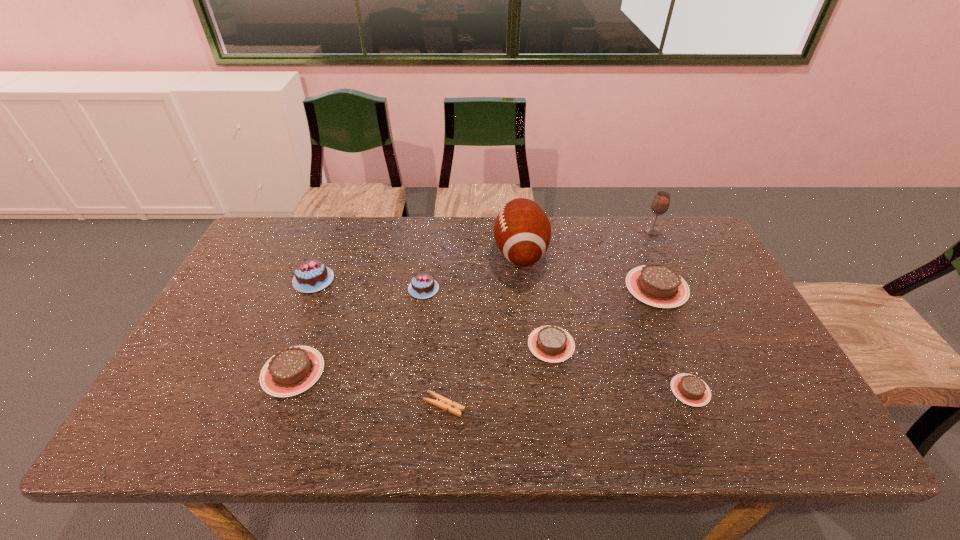
You are a GUI agent. You are given a task and a screenshot of the screen. Output one action in this format:
    pyautogui.click(x=<x>, y=<y>)
    Task: Click on the vacant point located between the clothespin and the third biggest brown chocolate cake
    The height and width of the screenshot is (540, 960).
    Given the screenshot: What is the action you would take?
    pyautogui.click(x=497, y=375)

The height and width of the screenshot is (540, 960). In order to click on free space between the left pink chocolate cake and the clothespin in this screenshot , I will do `click(379, 342)`.

Locate an element on the screen. The height and width of the screenshot is (540, 960). vacant area between the left pink chocolate cake and the glass drink container is located at coordinates tap(483, 256).

Where is `the fourth closest object relative to the second shortest chocolate cake`? the fourth closest object relative to the second shortest chocolate cake is located at coordinates click(x=690, y=389).

Identify which object is the eighth nearest to the right pink chocolate cake. Please provide its 2D coordinates. Your answer should be formatted as a tuple, i.e. [(x, y)], where the tuple contains the x and y coordinates of a point satisfying the conditions above.

[(660, 204)]

This screenshot has width=960, height=540. I want to click on chocolate cake identified as the fifth closest to the sixth tallest object, so click(x=690, y=389).

Select which chocolate cake is the second closest to the biggest brown chocolate cake. Please provide its 2D coordinates. Your answer should be formatted as a tuple, i.e. [(x, y)], where the tuple contains the x and y coordinates of a point satisfying the conditions above.

[(690, 389)]

Identify which brown chocolate cake is located as the second nearest to the biggest brown chocolate cake. Please provide its 2D coordinates. Your answer should be formatted as a tuple, i.e. [(x, y)], where the tuple contains the x and y coordinates of a point satisfying the conditions above.

[(690, 389)]

Identify which brown chocolate cake is located as the second nearest to the farthest brown chocolate cake. Please provide its 2D coordinates. Your answer should be formatted as a tuple, i.e. [(x, y)], where the tuple contains the x and y coordinates of a point satisfying the conditions above.

[(690, 389)]

You are a GUI agent. You are given a task and a screenshot of the screen. Output one action in this format:
    pyautogui.click(x=<x>, y=<y>)
    Task: Click on the vacant region that satisfies the following two spatial constraints: 1. on the laces of the football; 2. on the left side of the fourth chocolate cake from left to right
    This screenshot has width=960, height=540.
    Given the screenshot: What is the action you would take?
    pyautogui.click(x=530, y=345)